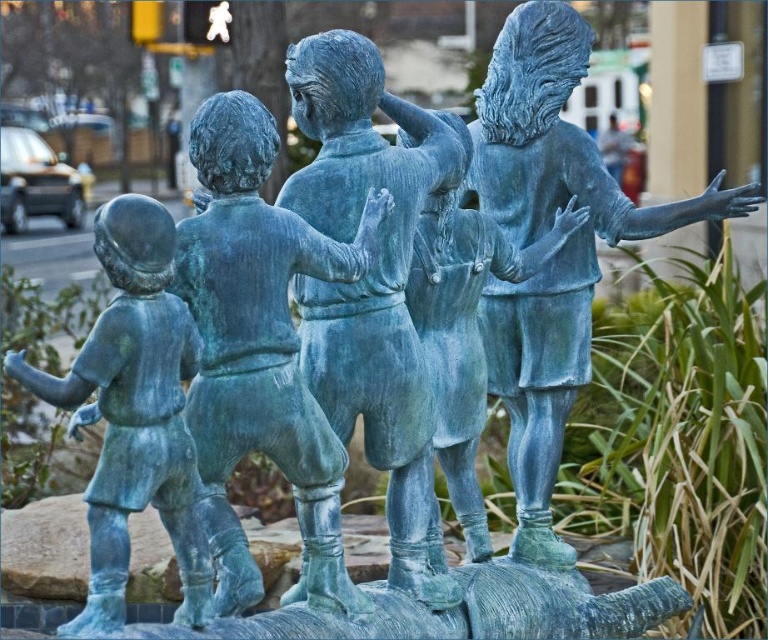
You are a GUI agent. You are given a task and a screenshot of the screen. Output one action in this format:
    pyautogui.click(x=<x>, y=<y>)
    Task: Click on the green patina statue at center
    Image resolution: width=768 pixels, height=640 pixels.
    Given the screenshot: What is the action you would take?
    pyautogui.click(x=260, y=348)

Who is more forward, (217,256) or (111,509)?

Positioned in front is point (111,509).

You are a GUI agent. You are given a task and a screenshot of the screen. Output one action in this format:
    pyautogui.click(x=<x>, y=<y>)
    Task: Click on the green patina statue at center
    This screenshot has height=640, width=768.
    Given the screenshot: What is the action you would take?
    pyautogui.click(x=260, y=348)

Measure the distance between point (x=306, y=369) and camera.

Point (x=306, y=369) and camera are 7.76 meters apart.

Describe the element at coordinates (369, 282) in the screenshot. I see `green patina bronze statue at center` at that location.

Describe the element at coordinates (369, 282) in the screenshot. I see `green patina bronze statue at center` at that location.

At what (x,y) coordinates should I click in order to perform the action: click on green patina bronze statue at center. Please return your answer as a coordinate pair (x, y). This screenshot has width=768, height=640. Looking at the image, I should click on [x=369, y=282].

Which is above, green patina statue at center or green patina bronze statue at center?

green patina bronze statue at center is higher up.

Identify the location of green patina statue at center. The height and width of the screenshot is (640, 768). pos(260,348).